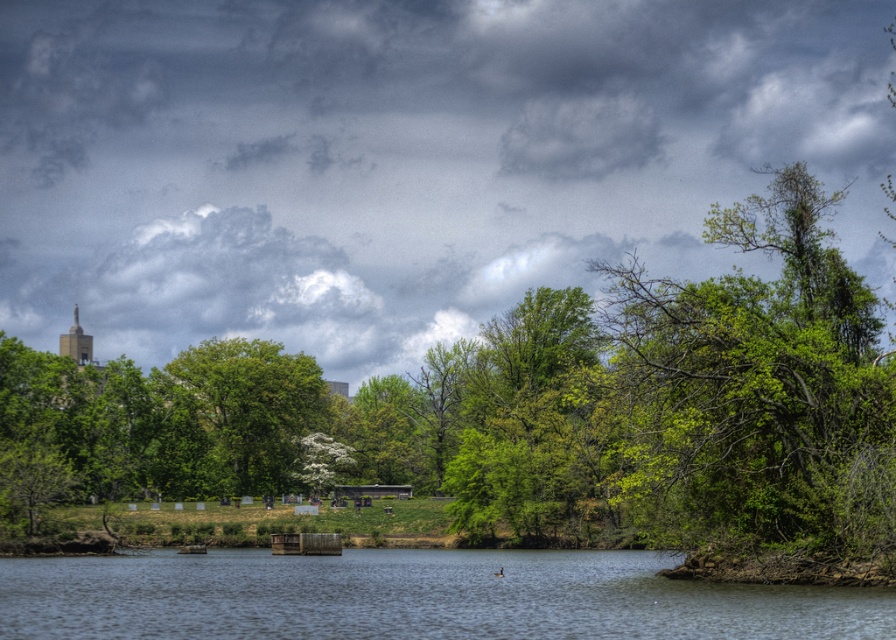
You are standing at the edge of the lake and want to take a photo of both the clear water at center and the green leafy tree at center. Which object will occupy more space in your photo?

The clear water at center will occupy more space in your photo since it has a larger size compared to the green leafy tree at center.

You are standing at the lakeside and notice the clear water at center and the green leafy tree at center. Which object is closer to you?

The clear water at center is positioned under the green leafy tree at center, so the water is closer to you.

You are standing at the lakeside and want to determine which object is shorter between the clear water at center and the green leafy tree at center. Based on the scene, which one is shorter?

The clear water at center is shorter than the green leafy tree at center according to the description.